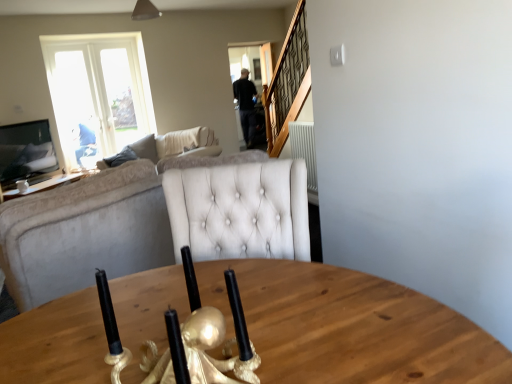
Question: Is transparent glass door at upper center not inside beige fabric couch at left, which appears as the 2th studio couch when viewed from the front?

Choices:
 (A) yes
 (B) no

Answer: (A)

Question: Could you tell me if transparent glass door at upper center is facing beige fabric couch at left, which is the 1th studio couch in top-to-bottom order?

Choices:
 (A) no
 (B) yes

Answer: (A)

Question: Does transparent glass door at upper center have a lesser height compared to beige fabric couch at left, arranged as the second studio couch when ordered from the bottom?

Choices:
 (A) yes
 (B) no

Answer: (B)

Question: From the image's perspective, is transparent glass door at upper center beneath beige fabric couch at left, acting as the first studio couch starting from the back?

Choices:
 (A) yes
 (B) no

Answer: (B)

Question: Is beige fabric couch at left, which appears as the 2th studio couch when viewed from the front, located within transparent glass door at upper center?

Choices:
 (A) yes
 (B) no

Answer: (B)

Question: Can you confirm if transparent glass door at upper center is positioned to the left of beige fabric couch at left, which appears as the 2th studio couch when viewed from the front?

Choices:
 (A) yes
 (B) no

Answer: (B)

Question: Is velvet beige couch at left, which is the 2th studio couch in top-to-bottom order, at the right side of white ceramic coffee cup at upper left?

Choices:
 (A) no
 (B) yes

Answer: (B)

Question: From a real-world perspective, is velvet beige couch at left, which is the 2th studio couch in top-to-bottom order, under white ceramic coffee cup at upper left?

Choices:
 (A) yes
 (B) no

Answer: (B)

Question: Can we say velvet beige couch at left, which appears as the 2th studio couch when viewed from the back, lies outside white ceramic coffee cup at upper left?

Choices:
 (A) yes
 (B) no

Answer: (A)

Question: From the image's perspective, would you say velvet beige couch at left, acting as the first studio couch starting from the bottom, is positioned over white ceramic coffee cup at upper left?

Choices:
 (A) yes
 (B) no

Answer: (B)

Question: Is white ceramic coffee cup at upper left surrounded by velvet beige couch at left, which appears as the 2th studio couch when viewed from the back?

Choices:
 (A) no
 (B) yes

Answer: (A)

Question: Is velvet beige couch at left, the first studio couch in the front-to-back sequence, positioned behind white ceramic coffee cup at upper left?

Choices:
 (A) no
 (B) yes

Answer: (A)

Question: Does white ceramic coffee cup at upper left have a lesser height compared to beige fabric couch at left, which is the 1th studio couch in top-to-bottom order?

Choices:
 (A) no
 (B) yes

Answer: (B)